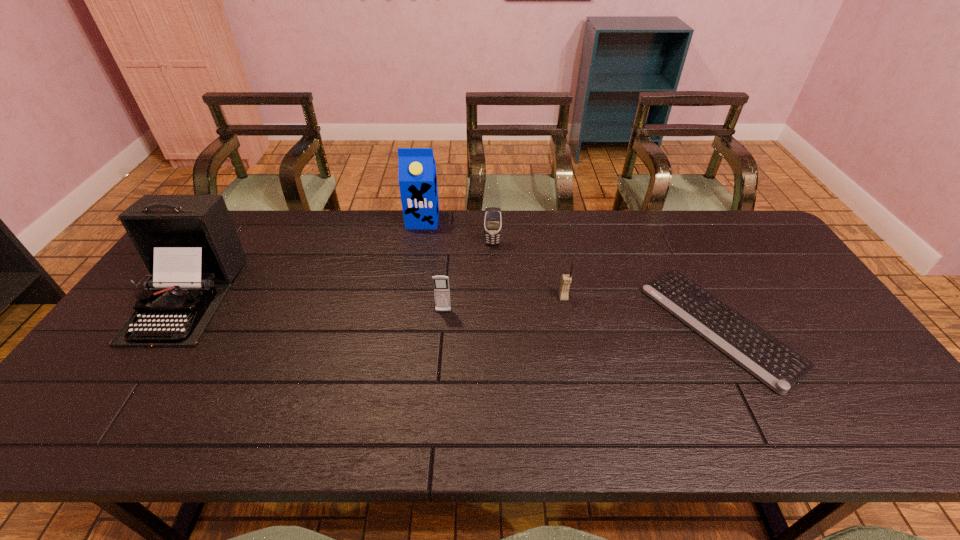
The height and width of the screenshot is (540, 960). Find the location of `object at the right edge`. object at the right edge is located at coordinates (778, 366).

I want to click on free space at the far edge of the desktop, so click(288, 217).

This screenshot has height=540, width=960. Identify the location of free region at the near edge. (736, 408).

Where is `vacant area that lies between the third object from right to left and the farthest object`? This screenshot has width=960, height=540. vacant area that lies between the third object from right to left and the farthest object is located at coordinates (458, 232).

Locate an element on the screen. vacant space that is in between the leftmost cellular telephone and the fifth object from right to left is located at coordinates (433, 266).

In order to click on vacant area that lies between the fifth object from right to left and the leftmost cellular telephone in this screenshot , I will do `click(433, 266)`.

Locate an element on the screen. The width and height of the screenshot is (960, 540). blank region between the leftmost object and the fifth object from left to right is located at coordinates (375, 298).

Locate an element on the screen. The image size is (960, 540). vacant space that is in between the third object from left to right and the computer keyboard is located at coordinates (582, 319).

Find the location of `free space between the carton and the second cellular telephone from left to right`. free space between the carton and the second cellular telephone from left to right is located at coordinates (458, 232).

The width and height of the screenshot is (960, 540). In order to click on vacant point located between the leftmost object and the second farthest cellular telephone in this screenshot , I will do `click(375, 298)`.